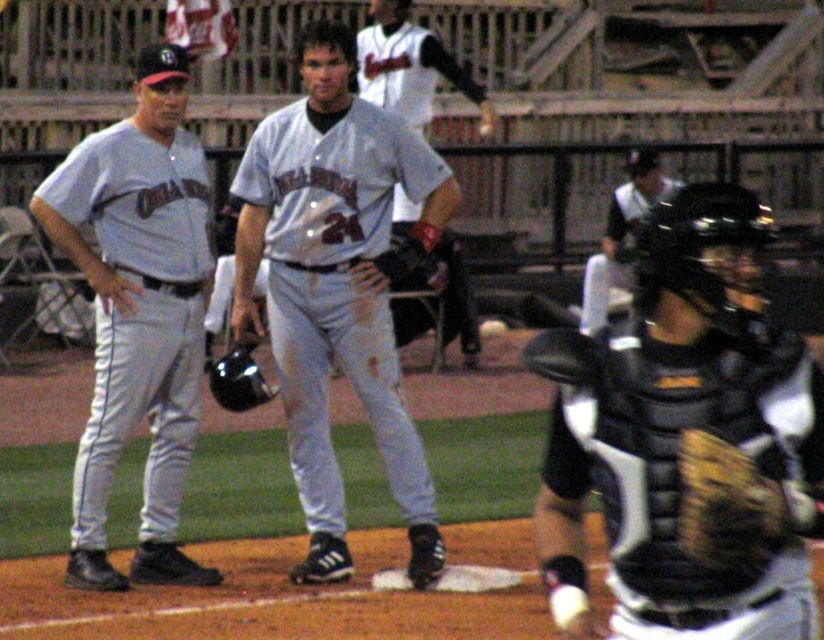
Is point (410, 227) in front of point (705, 506)?

No, it is not.

Is point (456, 304) farther from camera compared to point (747, 522)?

Yes, it is.

Where is `white jersey at center`? The image size is (824, 640). white jersey at center is located at coordinates (406, 65).

Is brown leather glove at lower right taller than black leather glove at center?

In fact, brown leather glove at lower right may be shorter than black leather glove at center.

Is point (715, 460) positioned before point (611, 268)?

Yes, it is in front of point (611, 268).

Locate an element on the screen. This screenshot has width=824, height=640. brown leather glove at lower right is located at coordinates (727, 506).

Is gray fabric uniform at left above brown leather glove at lower right?

Indeed, gray fabric uniform at left is positioned over brown leather glove at lower right.

Who is more forward, (174, 172) or (755, 545)?

Point (755, 545) is more forward.

Where is `gray fabric uniform at left`? Image resolution: width=824 pixels, height=640 pixels. gray fabric uniform at left is located at coordinates (138, 314).